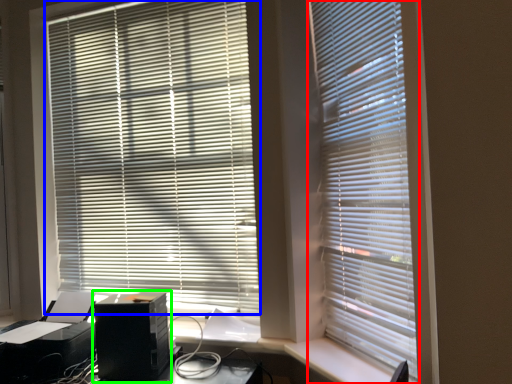
Question: Based on their relative distances, which object is farther from window blind (highlighted by a red box)? Choose from window blind (highlighted by a blue box) and computer tower (highlighted by a green box).

Choices:
 (A) window blind
 (B) computer tower

Answer: (B)